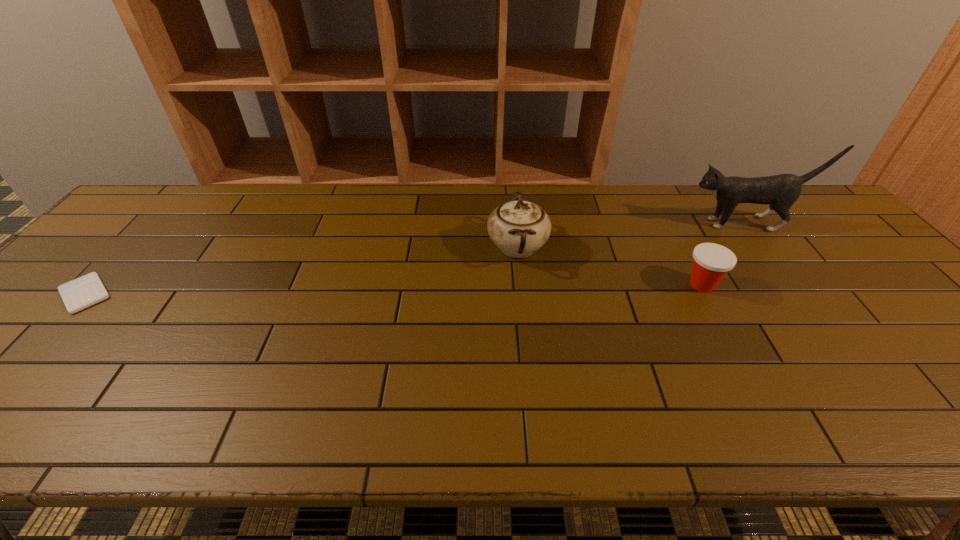
The image size is (960, 540). In order to click on free space located 0.260m on the left of the third tallest object in this screenshot , I will do `click(583, 285)`.

You are a GUI agent. You are given a task and a screenshot of the screen. Output one action in this format:
    pyautogui.click(x=<x>, y=<y>)
    Task: Click on the vacant space located 0.160m on the back of the leftmost object
    This screenshot has height=540, width=960.
    Given the screenshot: What is the action you would take?
    pyautogui.click(x=136, y=238)

Identify the location of cat present at the far edge. (781, 191).

At what (x,y) coordinates should I click in order to perform the action: click on chinaware present at the far edge. Please return your answer as a coordinate pair (x, y). The height and width of the screenshot is (540, 960). Looking at the image, I should click on (518, 227).

Image resolution: width=960 pixels, height=540 pixels. Identify the location of object that is positioned at the left edge. (78, 294).

This screenshot has height=540, width=960. What are the coordinates of `object at the right edge` in the screenshot? It's located at (781, 191).

I want to click on object that is positioned at the far right corner, so click(x=781, y=191).

Image resolution: width=960 pixels, height=540 pixels. What are the coordinates of `vacant space at the far edge` in the screenshot? It's located at (320, 195).

In the image, there is a desktop. In order to click on vacant area at the near edge in this screenshot , I will do `click(383, 440)`.

This screenshot has height=540, width=960. In the image, there is a desktop. Find the location of `vacant space at the left edge`. vacant space at the left edge is located at coordinates (81, 319).